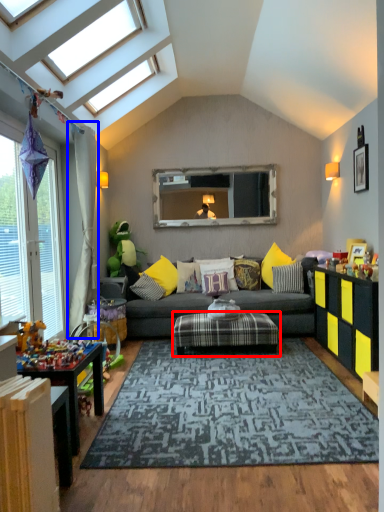
Question: Among these objects, which one is nearest to the camera, coffee table (highlighted by a red box) or curtain (highlighted by a blue box)?

Choices:
 (A) coffee table
 (B) curtain

Answer: (A)